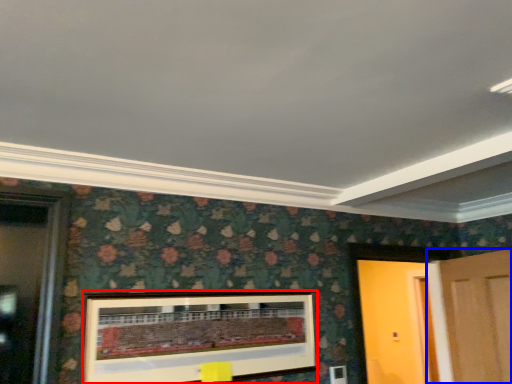
Question: Which object appears closest to the camera in this image, picture frame (highlighted by a red box) or door (highlighted by a blue box)?

Choices:
 (A) picture frame
 (B) door

Answer: (A)